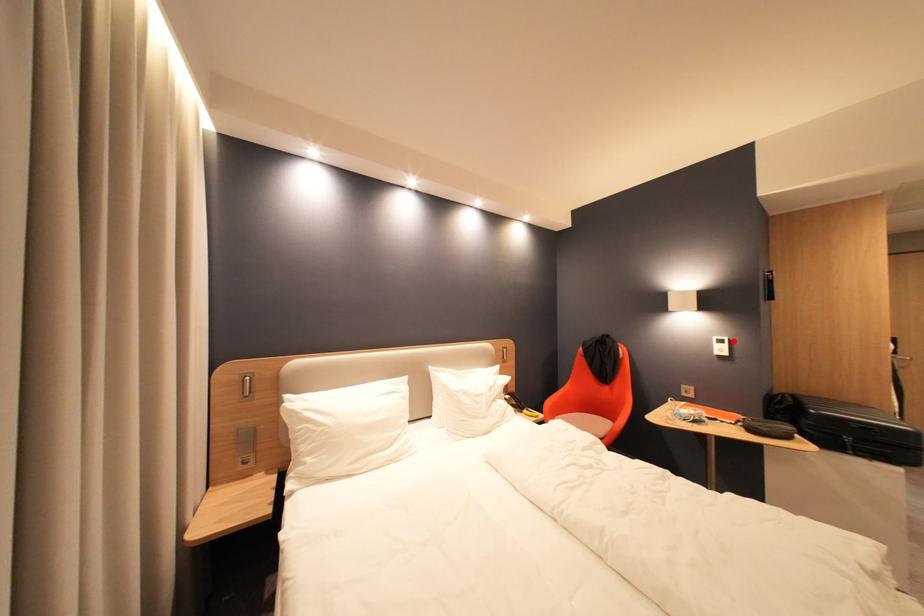
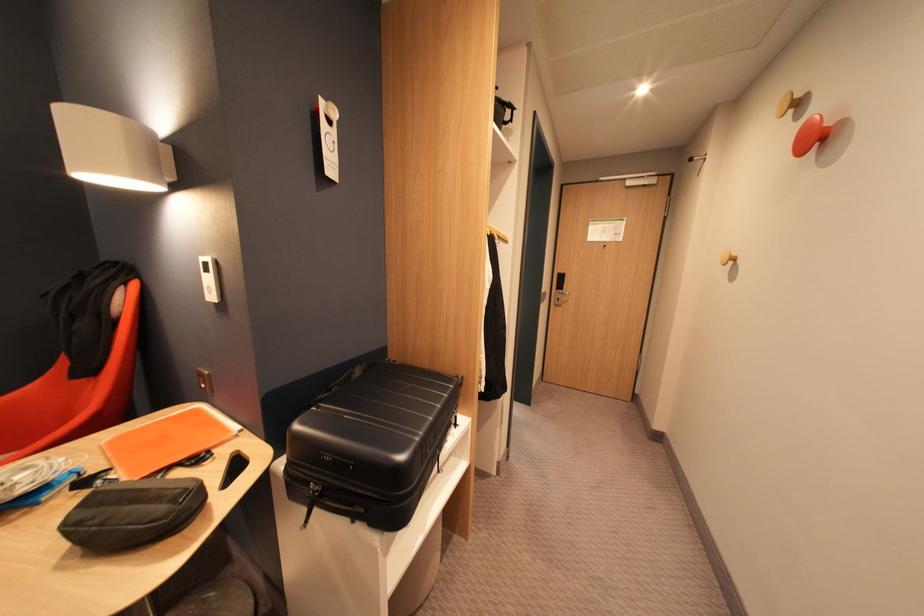
The point at the highlighted location is marked in the first image. Where is the corresponding point in the second image?

(216, 265)